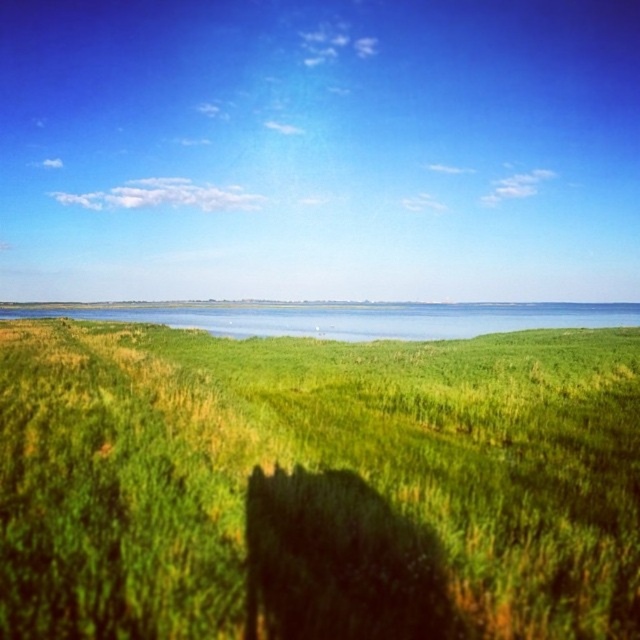
You are a landscape photographer planning to capture the entire scene in one shot. Given that the green grassy field at center and the blue water at center are both in the frame, which object takes up more area in the image?

The blue water at center occupies more area than the green grassy field at center in the image.

You are standing at the point labeled point (145, 564) and want to walk towards the point labeled point (86, 316). Based on the scene description, which direction should you move to get closer to your destination?

You should move towards the upper left direction because point (86, 316) is further away from the viewer compared to point (145, 564), so moving towards the upper left would take you closer to the destination.